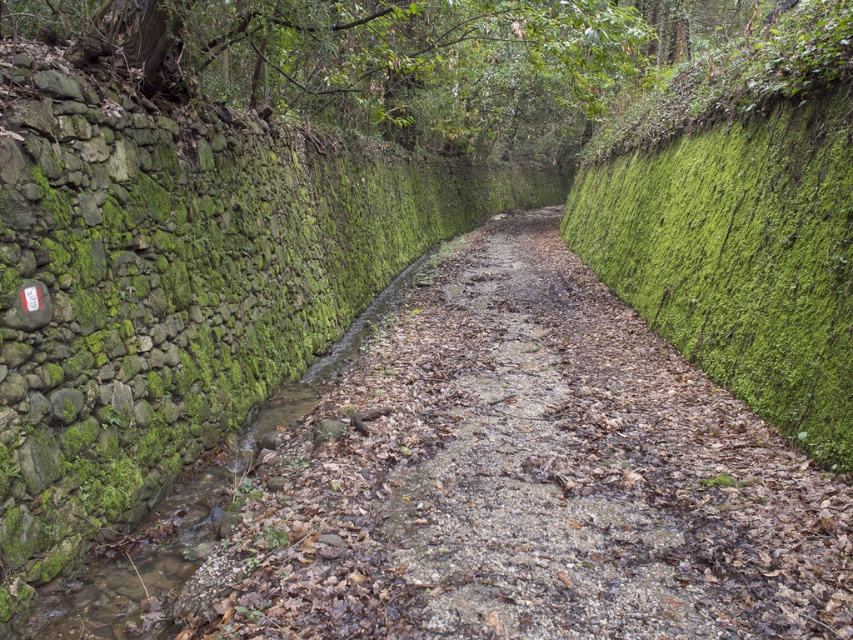
You are a gardener who wants to trim the green mossy hedge at right and the green mossy stone stream at left. Which one requires a taller ladder to reach the top?

The green mossy hedge at right requires a taller ladder to reach the top because it has a greater height compared to the green mossy stone stream at left.

You are a hiker standing at the point marked as point (740, 220). You want to walk towards the green mossy hedge at right. Which direction should you move relative to the channel?

The green mossy hedge at right is located to the right of point (740, 220), so you should move towards the right direction relative to the channel.